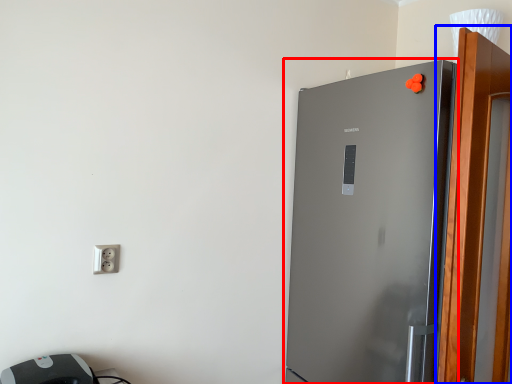
Question: Which point is closer to the camera, refrigerator (highlighted by a red box) or screen door (highlighted by a blue box)?

Choices:
 (A) refrigerator
 (B) screen door

Answer: (B)